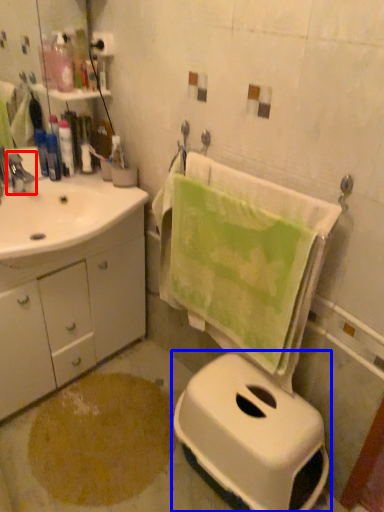
Question: Among these objects, which one is farthest to the camera, tap (highlighted by a red box) or toilet (highlighted by a blue box)?

Choices:
 (A) tap
 (B) toilet

Answer: (A)